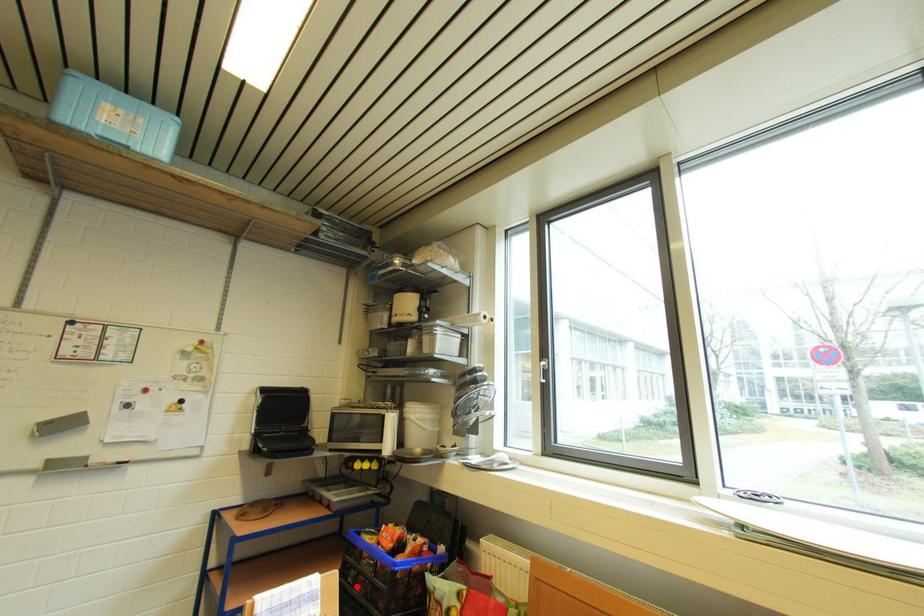
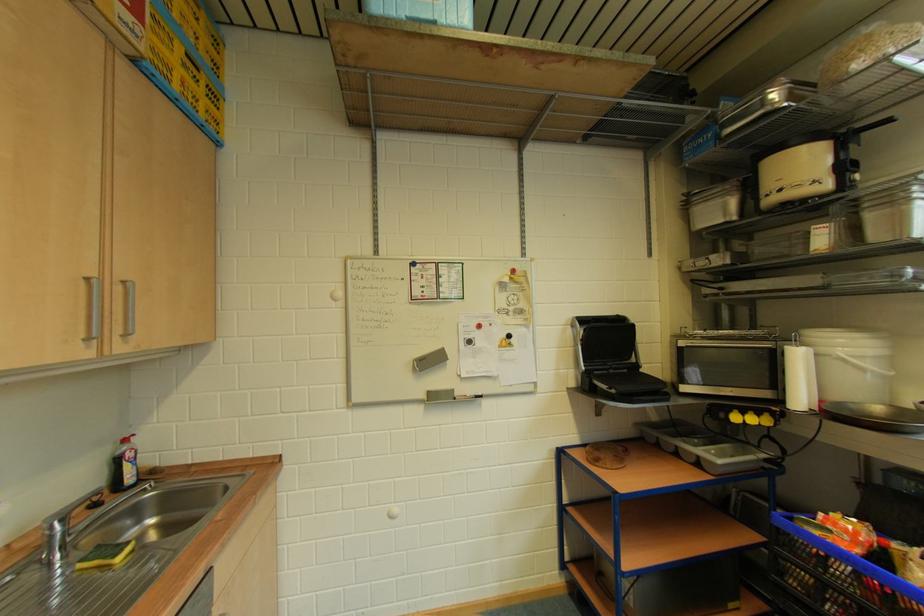
Locate, in the second image, the point that corresponds to the highlighted location in the first image.

(803, 591)